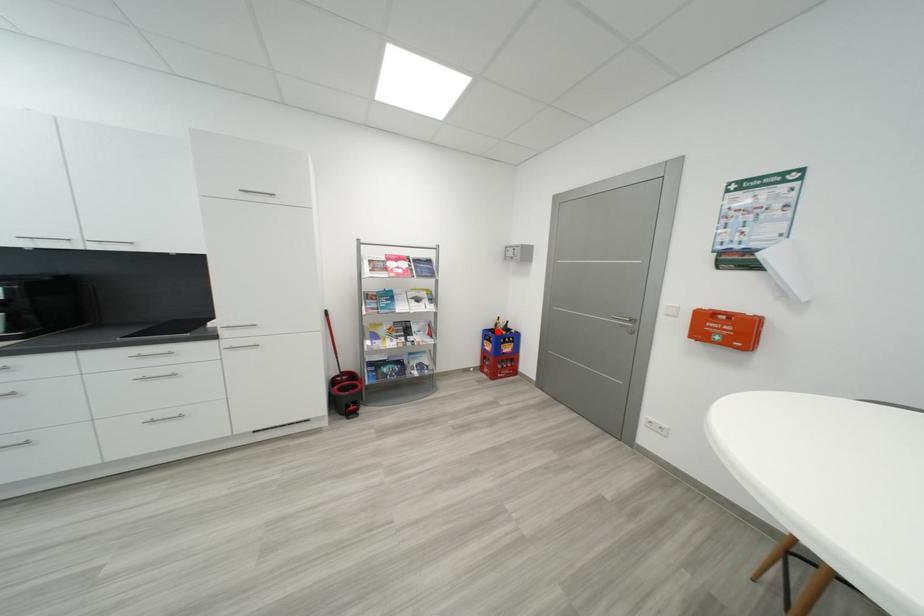
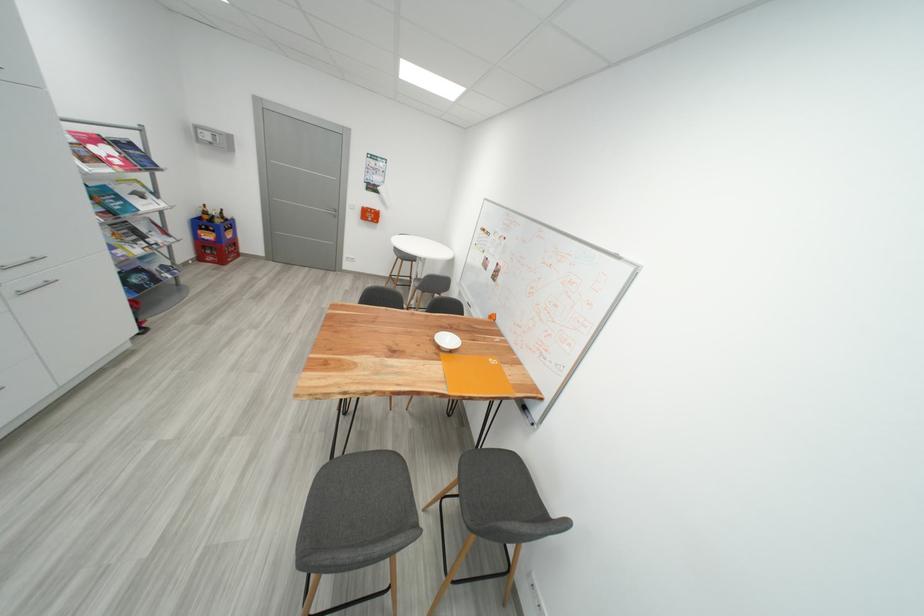
Locate, in the second image, the point that corresponds to the highlighted location in the first image.

(208, 220)